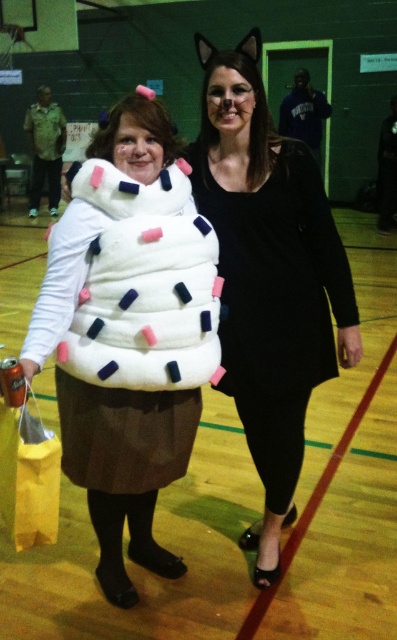
Question: Considering the relative positions of fuzzy white cupcake at center and black matte dress at center in the image provided, where is fuzzy white cupcake at center located with respect to black matte dress at center?

Choices:
 (A) left
 (B) right

Answer: (A)

Question: Is fuzzy white cupcake at center smaller than black matte dress at center?

Choices:
 (A) yes
 (B) no

Answer: (A)

Question: Does fuzzy white cupcake at center appear over black matte dress at center?

Choices:
 (A) yes
 (B) no

Answer: (B)